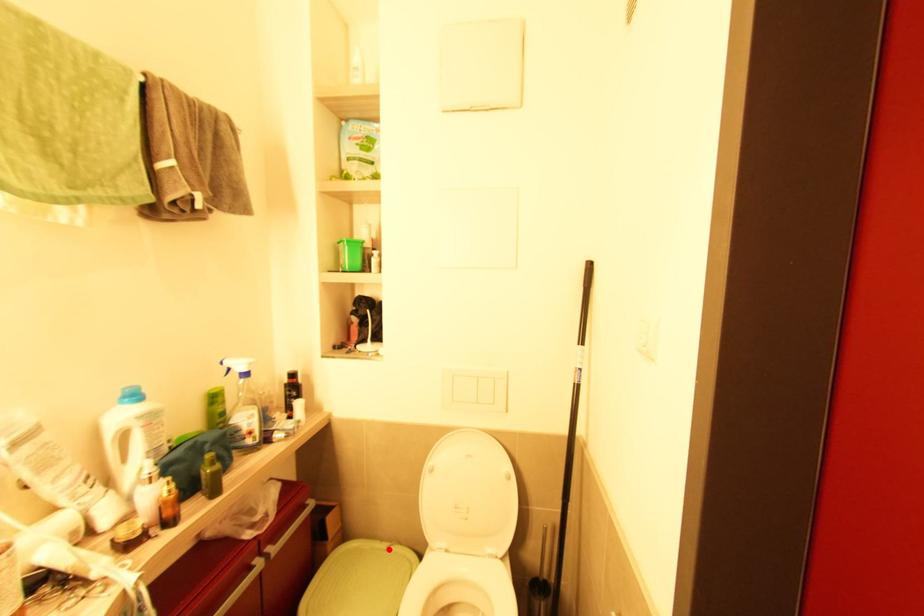
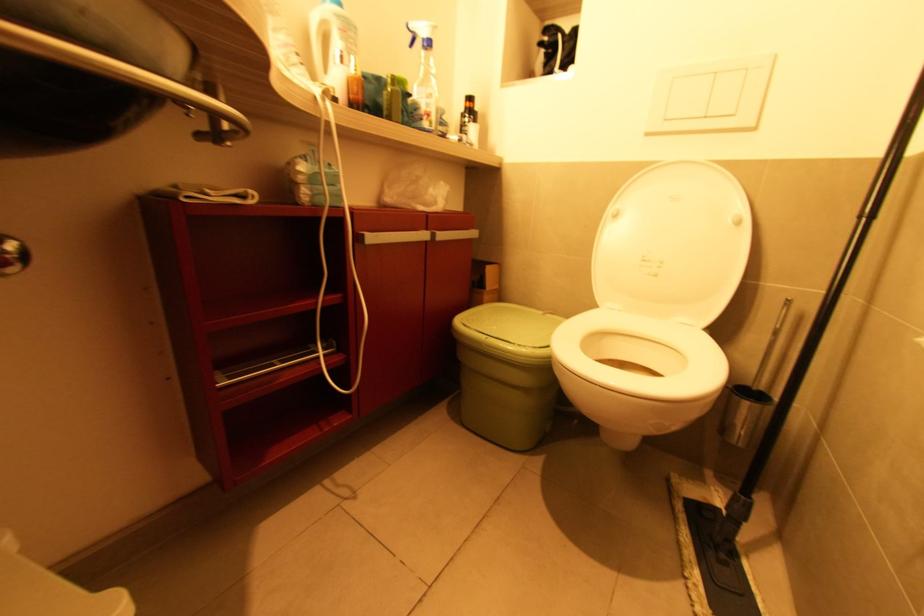
In the second image, find the point that corresponds to the highlighted location in the first image.

(545, 314)